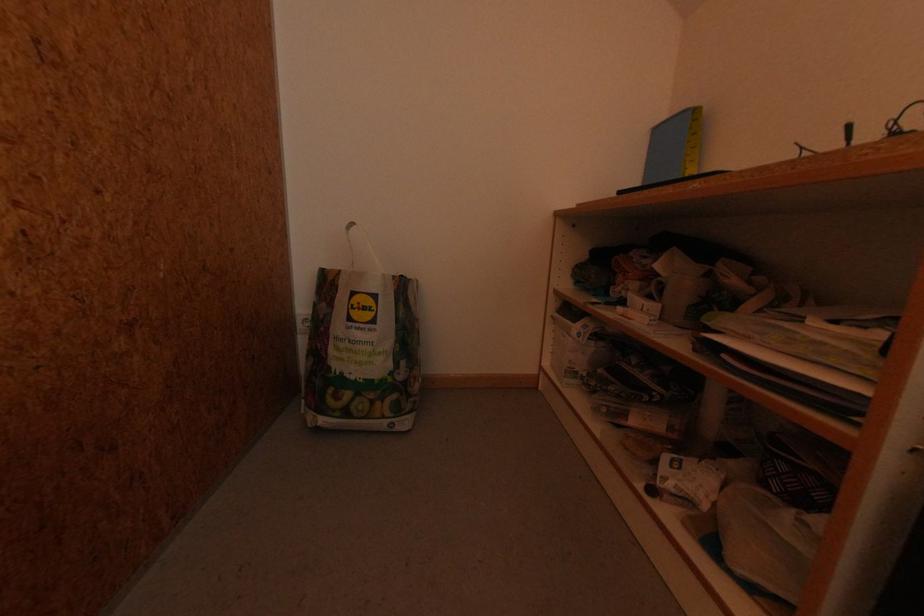
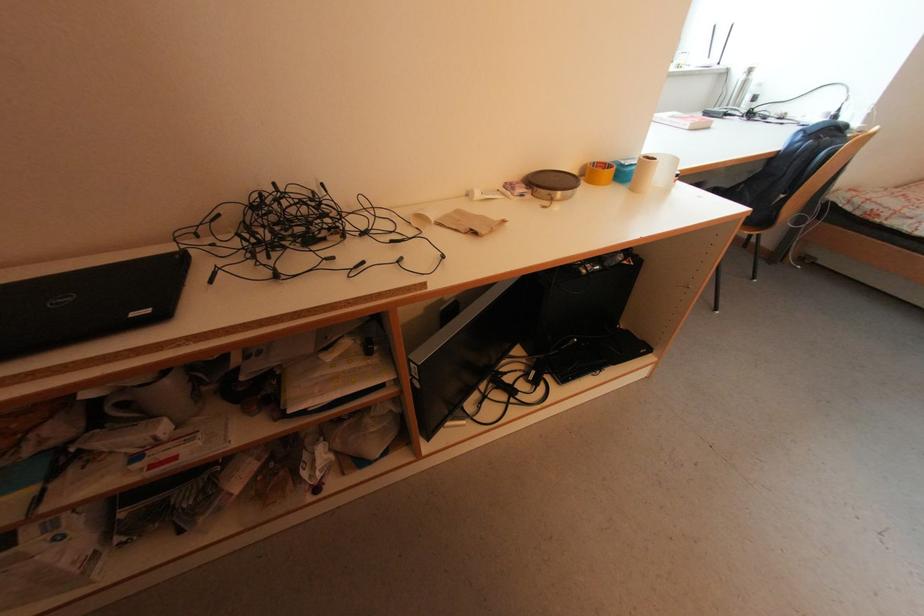
The first image is from the beginning of the video and the second image is from the end. How did the camera likely rotate when shooting the video?

The rotation direction of the camera is right-down.